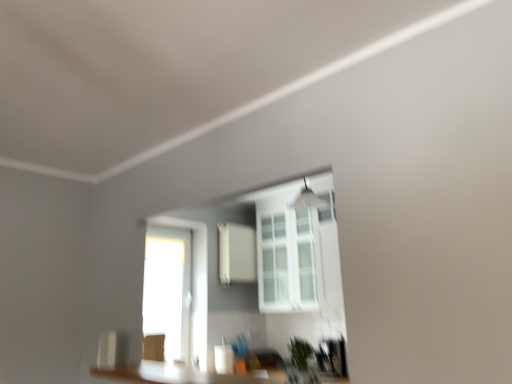
Question: In the image, is white matte medicine cabinet at center positioned in front of or behind green matte plant at lower center?

Choices:
 (A) behind
 (B) front

Answer: (A)

Question: From a real-world perspective, is white matte medicine cabinet at center above or below green matte plant at lower center?

Choices:
 (A) below
 (B) above

Answer: (B)

Question: Which is nearer to the white glass window at center?

Choices:
 (A) green matte plant at lower center
 (B) white matte medicine cabinet at center

Answer: (B)

Question: Which of these objects is positioned farthest from the white matte medicine cabinet at center?

Choices:
 (A) white glass window at center
 (B) green matte plant at lower center

Answer: (B)